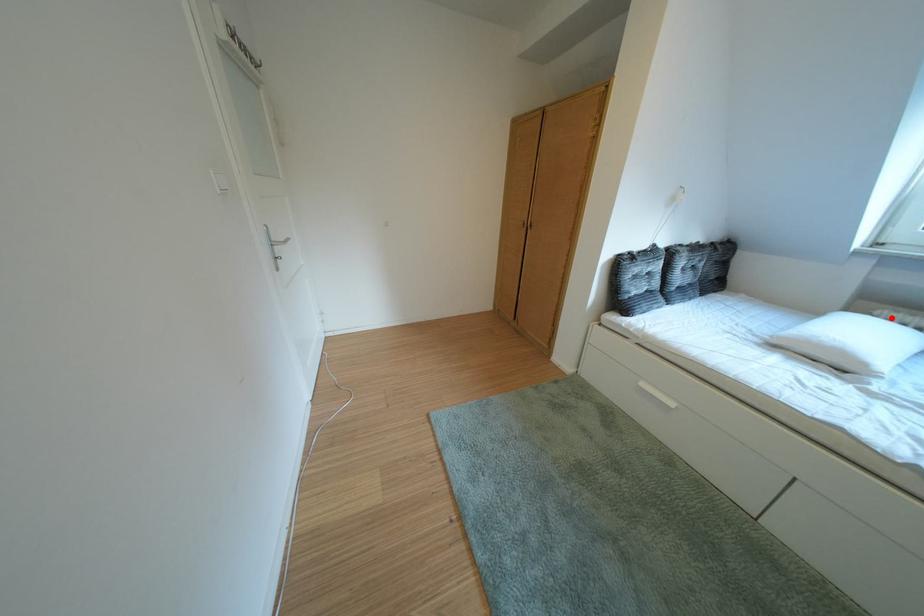
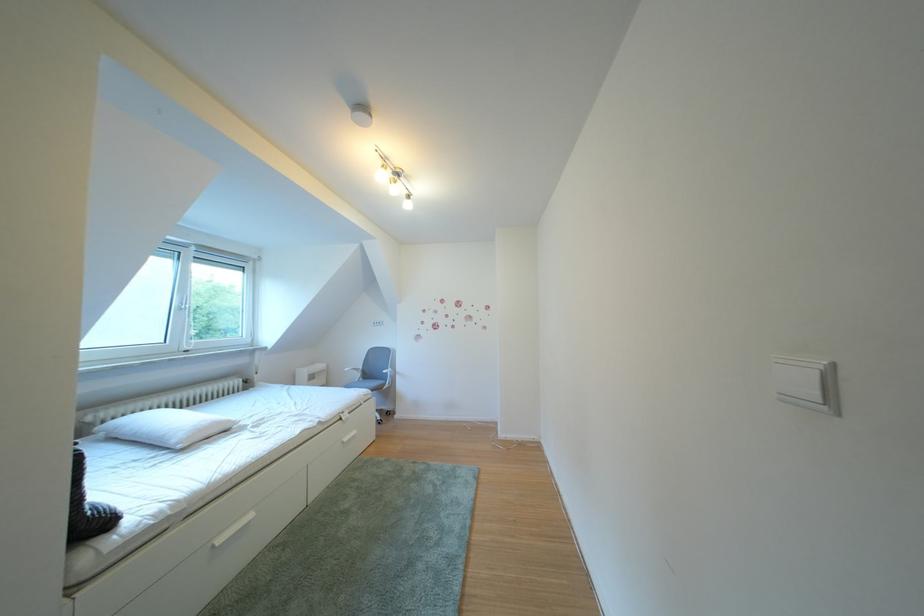
Where in the second image is the point corresponding to the highlighted location from the first image?

(103, 424)